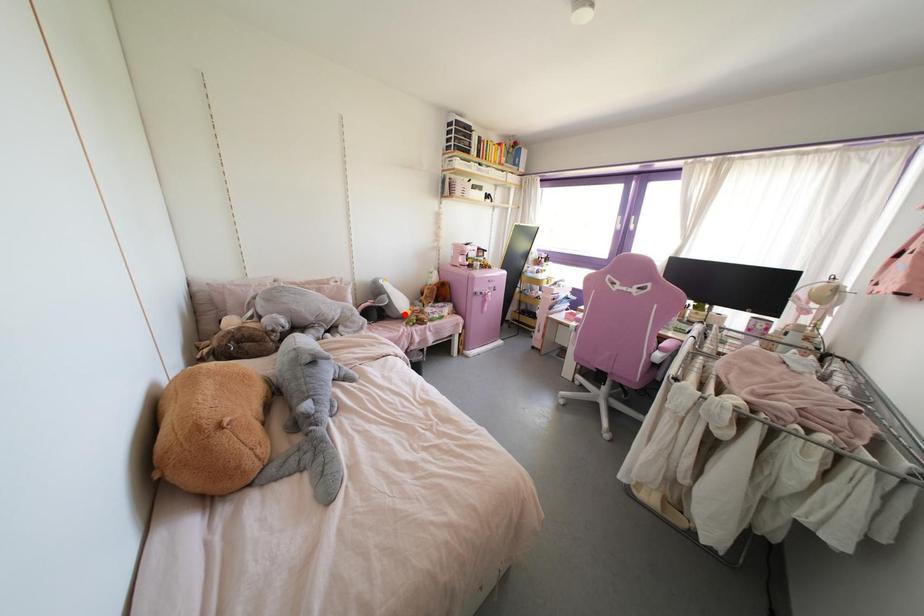
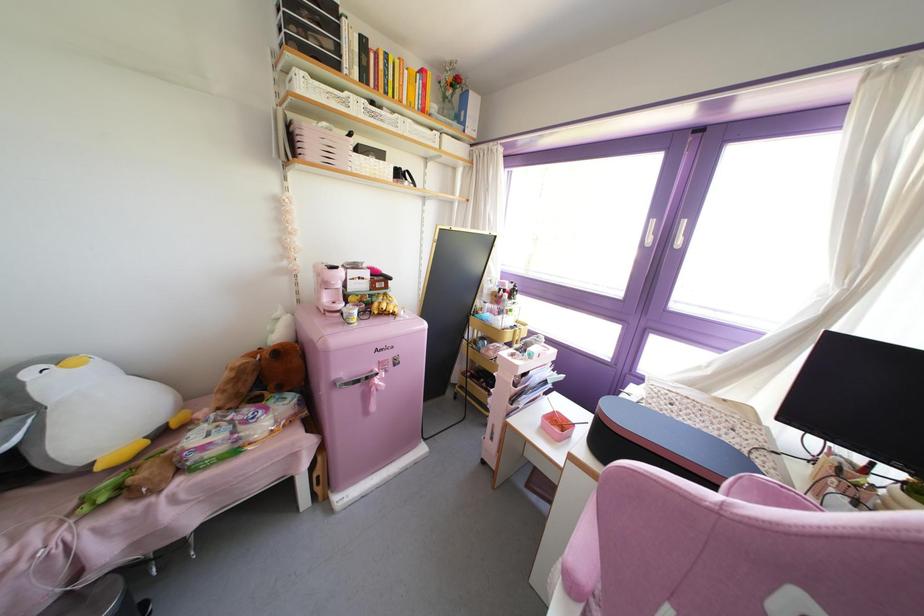
Question: I am providing you with two images of the same scene from different viewpoints. A red point is marked on the first image. At the location where the point appears in image 1, is it still visible in image 2?

Choices:
 (A) Yes
 (B) No

Answer: (A)